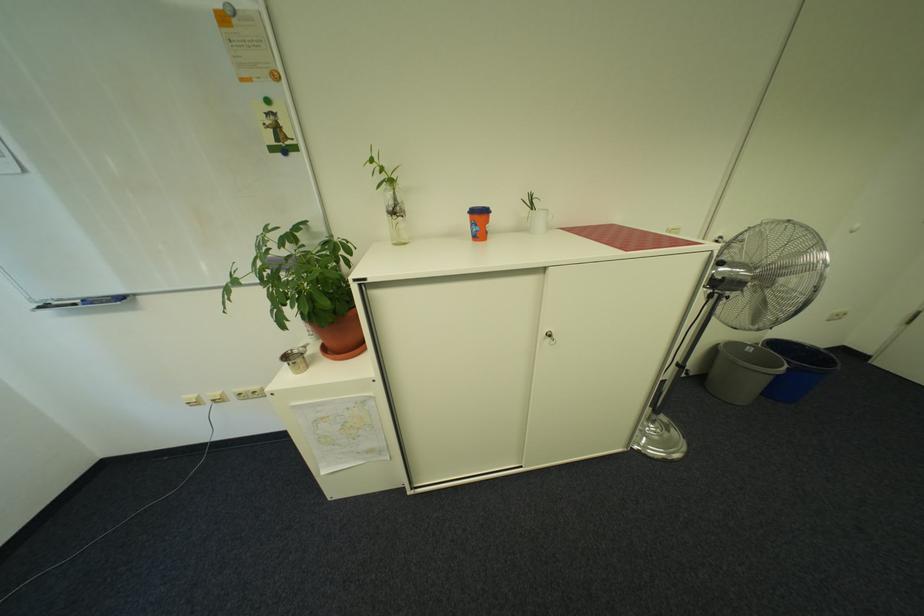
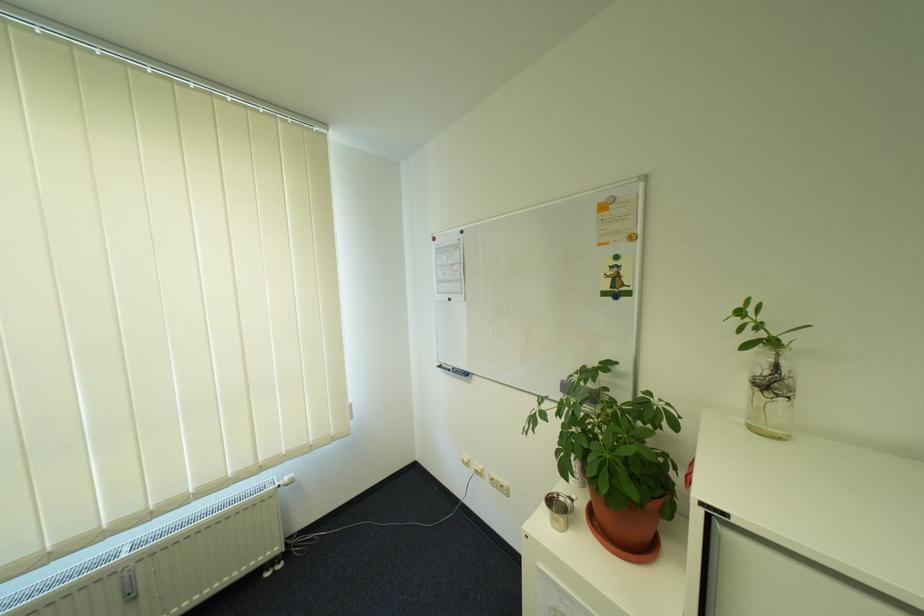
In the second image, find the point that corresponds to point (282, 150) in the first image.

(614, 294)